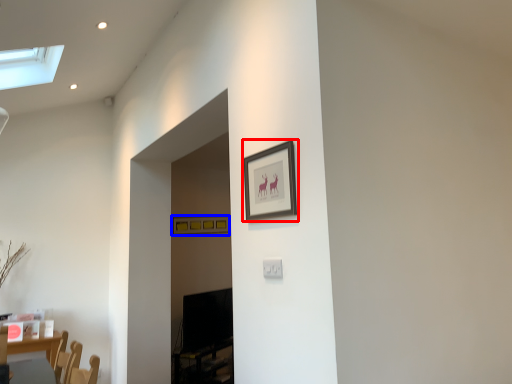
Question: Which point is further to the camera, picture frame (highlighted by a red box) or picture frame (highlighted by a blue box)?

Choices:
 (A) picture frame
 (B) picture frame

Answer: (B)